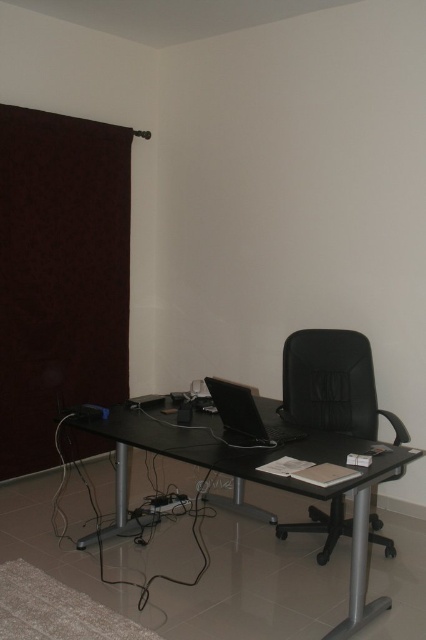
Is point (11, 436) positioned behind point (345, 337)?

Yes, it is behind point (345, 337).

How far apart are dark brown fabric curtain at left and black mesh office chair at center?

dark brown fabric curtain at left and black mesh office chair at center are 5.95 feet apart from each other.

What do you see at coordinates (60, 275) in the screenshot?
I see `dark brown fabric curtain at left` at bounding box center [60, 275].

You are a GUI agent. You are given a task and a screenshot of the screen. Output one action in this format:
    pyautogui.click(x=<x>, y=<y>)
    Task: Click on the dark brown fabric curtain at left
    This screenshot has height=640, width=426.
    Given the screenshot: What is the action you would take?
    coord(60,275)

Is point (134, 529) positioned after point (328, 401)?

That is False.

Is black glass computer desk at center thinner than black mesh office chair at center?

No, black glass computer desk at center is not thinner than black mesh office chair at center.

This screenshot has height=640, width=426. Find the location of `black glass computer desk at center`. black glass computer desk at center is located at coordinates (247, 480).

Locate an element on the screen. The width and height of the screenshot is (426, 640). black glass computer desk at center is located at coordinates [x=247, y=480].

Is black mesh office chair at center positioned at the back of black glossy laptop at center?

Yes.

Can you confirm if black mesh office chair at center is positioned below black glossy laptop at center?

No.

Which is in front, point (314, 342) or point (258, 435)?

Point (258, 435) is in front.

Image resolution: width=426 pixels, height=640 pixels. Find the location of `black mesh office chair at center`. black mesh office chair at center is located at coordinates (331, 385).